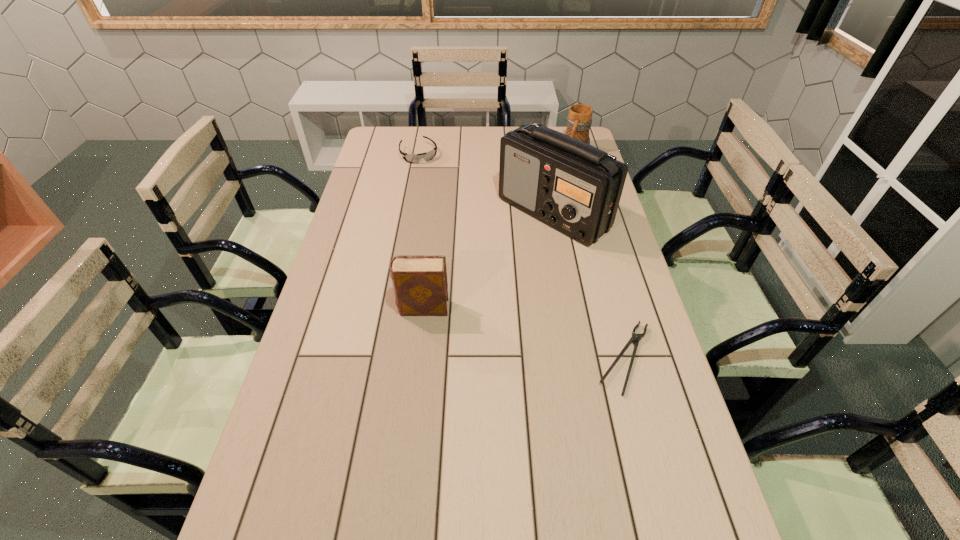
You are a GUI agent. You are given a task and a screenshot of the screen. Output one action in this format:
    pyautogui.click(x=<x>, y=<y>)
    Task: Click on the vacant space on the desktop that is between the diary and the nearest object and is positioned on the front panel of the radio receiver
    
    Given the screenshot: What is the action you would take?
    pyautogui.click(x=525, y=333)

This screenshot has width=960, height=540. In order to click on vacant space on the desktop that is between the fourth farthest object and the nearest object and is positioned on the side of the mug with the handle in this screenshot , I will do `click(490, 325)`.

You are a GUI agent. You are given a task and a screenshot of the screen. Output one action in this format:
    pyautogui.click(x=<x>, y=<y>)
    Task: Click on the free spot on the desktop that is between the diary and the shortest object and is positioned on the lenses of the sunglasses
    The width and height of the screenshot is (960, 540).
    Given the screenshot: What is the action you would take?
    pyautogui.click(x=518, y=332)